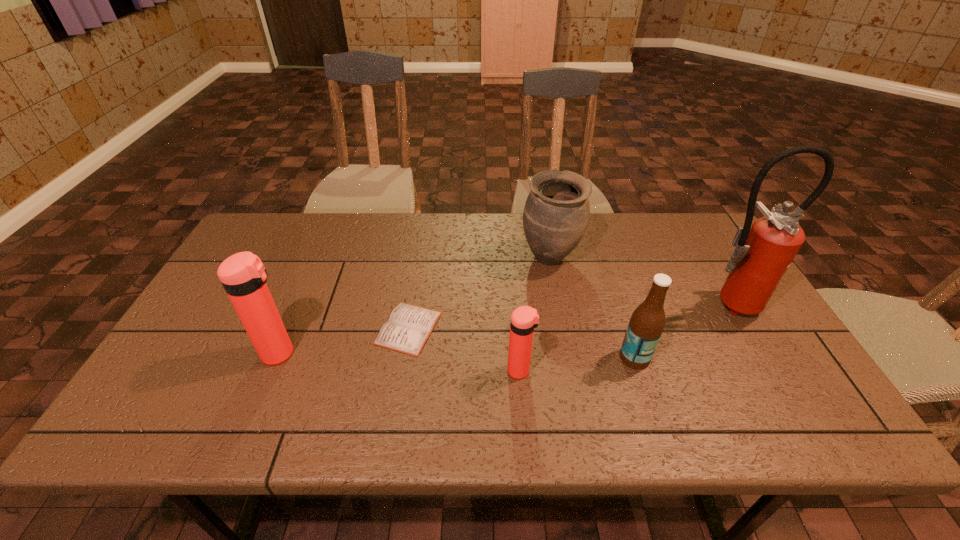
Locate an element on the screen. The image size is (960, 540). free spot located 0.070m on the left of the left thermos bottle is located at coordinates (233, 354).

This screenshot has width=960, height=540. I want to click on free space located on the right of the shorter thermos bottle, so click(x=681, y=371).

At what (x,y) coordinates should I click in order to perform the action: click on vacant space located on the right of the urn. Please return your answer as a coordinate pair (x, y). Image resolution: width=960 pixels, height=540 pixels. Looking at the image, I should click on (636, 258).

Locate an element on the screen. The height and width of the screenshot is (540, 960). vacant space located on the front of the shortest object is located at coordinates (398, 393).

Find the location of `vacant space situated on the right of the beer bottle`. vacant space situated on the right of the beer bottle is located at coordinates (744, 358).

At what (x,y) coordinates should I click in order to perform the action: click on vacant space situated 0.060m at the nozzle of the tallest object. Please return your answer as a coordinate pair (x, y). The image size is (960, 540). Looking at the image, I should click on click(x=747, y=340).

Where is `object present at the far edge`? object present at the far edge is located at coordinates (556, 214).

You are a GUI agent. You are given a task and a screenshot of the screen. Output one action in this format:
    pyautogui.click(x=<x>, y=<y>)
    Task: Click on the beer bottle that is at the near edge
    Image resolution: width=960 pixels, height=540 pixels.
    Given the screenshot: What is the action you would take?
    pyautogui.click(x=647, y=322)

What are the coordinates of `object that is positioned at the right edge` in the screenshot? It's located at click(x=763, y=253).

This screenshot has height=540, width=960. Identify the location of vacant space at the far edge. (492, 215).